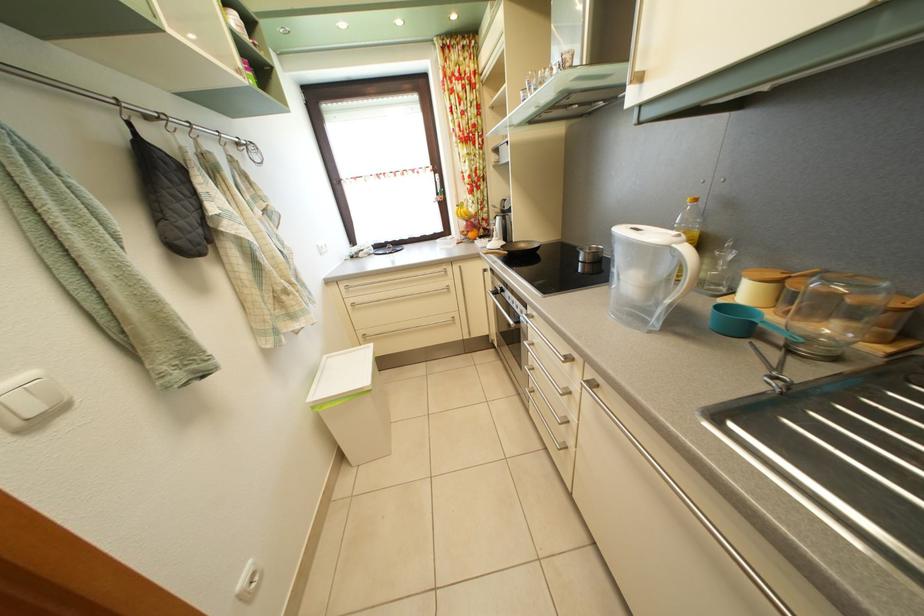
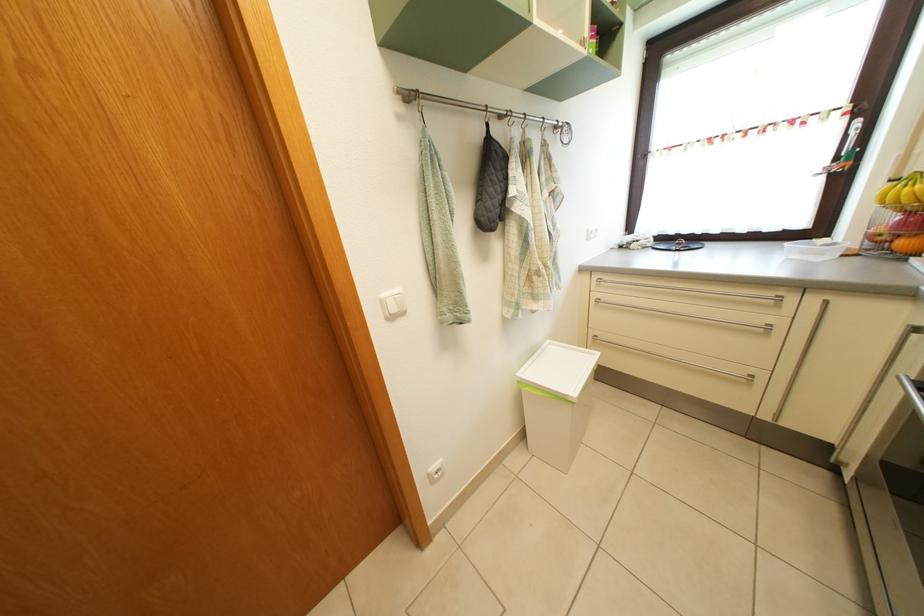
Question: The first image is from the beginning of the video and the second image is from the end. How did the camera likely rotate when shooting the video?

Choices:
 (A) Left
 (B) Right
 (C) Up
 (D) Down

Answer: (A)